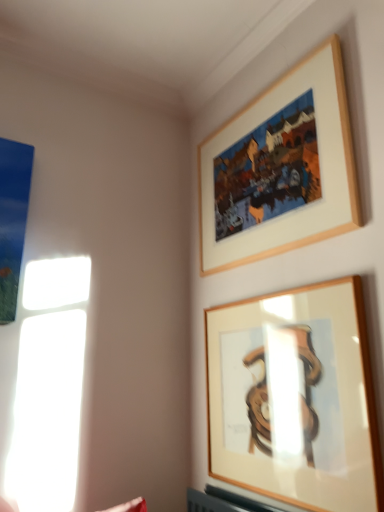
Question: In terms of size, does wooden frame at upper center, positioned as the second picture frame in top-to-bottom order, appear bigger or smaller than wooden frame at upper center, the first picture frame in the top-to-bottom sequence?

Choices:
 (A) small
 (B) big

Answer: (A)

Question: From the image's perspective, relative to wooden frame at upper center, the first picture frame in the top-to-bottom sequence, is wooden frame at upper center, positioned as the second picture frame in top-to-bottom order, above or below?

Choices:
 (A) above
 (B) below

Answer: (B)

Question: Is wooden frame at upper center, positioned as the second picture frame in top-to-bottom order, in front of or behind wooden frame at upper center, the first picture frame in the top-to-bottom sequence, in the image?

Choices:
 (A) front
 (B) behind

Answer: (A)

Question: Would you say wooden frame at upper center, which ranks as the second picture frame in bottom-to-top order, is to the left or to the right of wooden frame at upper center, marked as the 1th picture frame in a bottom-to-top arrangement, in the picture?

Choices:
 (A) right
 (B) left

Answer: (B)

Question: Is wooden frame at upper center, which ranks as the second picture frame in bottom-to-top order, spatially inside wooden frame at upper center, marked as the 1th picture frame in a bottom-to-top arrangement, or outside of it?

Choices:
 (A) inside
 (B) outside

Answer: (B)

Question: From a real-world perspective, relative to wooden frame at upper center, positioned as the second picture frame in top-to-bottom order, is wooden frame at upper center, which ranks as the second picture frame in bottom-to-top order, vertically above or below?

Choices:
 (A) above
 (B) below

Answer: (A)

Question: Looking at their shapes, would you say wooden frame at upper center, the first picture frame in the top-to-bottom sequence, is wider or thinner than wooden frame at upper center, positioned as the second picture frame in top-to-bottom order?

Choices:
 (A) thin
 (B) wide

Answer: (B)